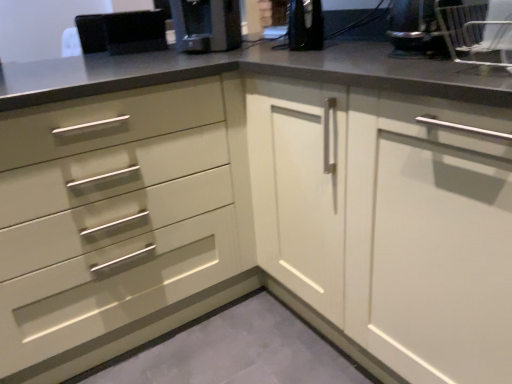
Question: From a real-world perspective, is matte white cabinet at right located higher than satin black coffee machine at upper center?

Choices:
 (A) yes
 (B) no

Answer: (B)

Question: Is matte white cabinet at right shorter than satin black coffee machine at upper center?

Choices:
 (A) yes
 (B) no

Answer: (B)

Question: Is matte white cabinet at right bigger than satin black coffee machine at upper center?

Choices:
 (A) no
 (B) yes

Answer: (B)

Question: Is matte white cabinet at right behind satin black coffee machine at upper center?

Choices:
 (A) yes
 (B) no

Answer: (B)

Question: From the image's perspective, does matte white cabinet at right appear lower than satin black coffee machine at upper center?

Choices:
 (A) no
 (B) yes

Answer: (B)

Question: Is point (385, 306) closer or farther from the camera than point (225, 13)?

Choices:
 (A) closer
 (B) farther

Answer: (A)

Question: Is matte white cabinet at right inside or outside of satin black coffee machine at upper center?

Choices:
 (A) outside
 (B) inside

Answer: (A)

Question: Considering the positions of matte white cabinet at right and satin black coffee machine at upper center in the image, is matte white cabinet at right bigger or smaller than satin black coffee machine at upper center?

Choices:
 (A) big
 (B) small

Answer: (A)

Question: Considering their positions, is matte white cabinet at right located in front of or behind satin black coffee machine at upper center?

Choices:
 (A) behind
 (B) front

Answer: (B)

Question: In terms of height, does satin black coffee machine at upper center look taller or shorter compared to matte white cabinet at right?

Choices:
 (A) tall
 (B) short

Answer: (B)

Question: Is satin black coffee machine at upper center to the left or to the right of matte white cabinet at right in the image?

Choices:
 (A) left
 (B) right

Answer: (A)

Question: Relative to matte white cabinet at right, is satin black coffee machine at upper center in front or behind?

Choices:
 (A) front
 (B) behind

Answer: (B)

Question: Is point (187, 29) positioned closer to the camera than point (262, 150)?

Choices:
 (A) farther
 (B) closer

Answer: (A)

Question: In terms of height, does black plastic bowl at upper right look taller or shorter compared to matte white cabinet at right?

Choices:
 (A) tall
 (B) short

Answer: (B)

Question: Relative to matte white cabinet at right, is black plastic bowl at upper right in front or behind?

Choices:
 (A) behind
 (B) front

Answer: (A)